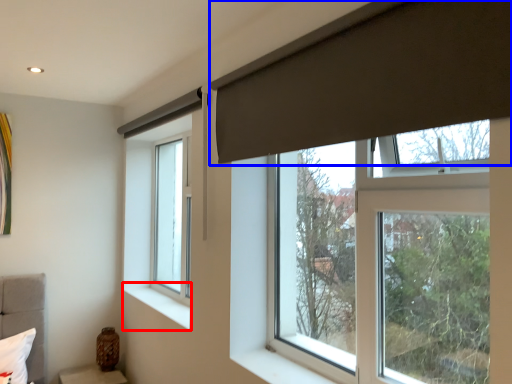
Question: Which object appears farthest to the camera in this image, window sill (highlighted by a red box) or curtain (highlighted by a blue box)?

Choices:
 (A) window sill
 (B) curtain

Answer: (A)